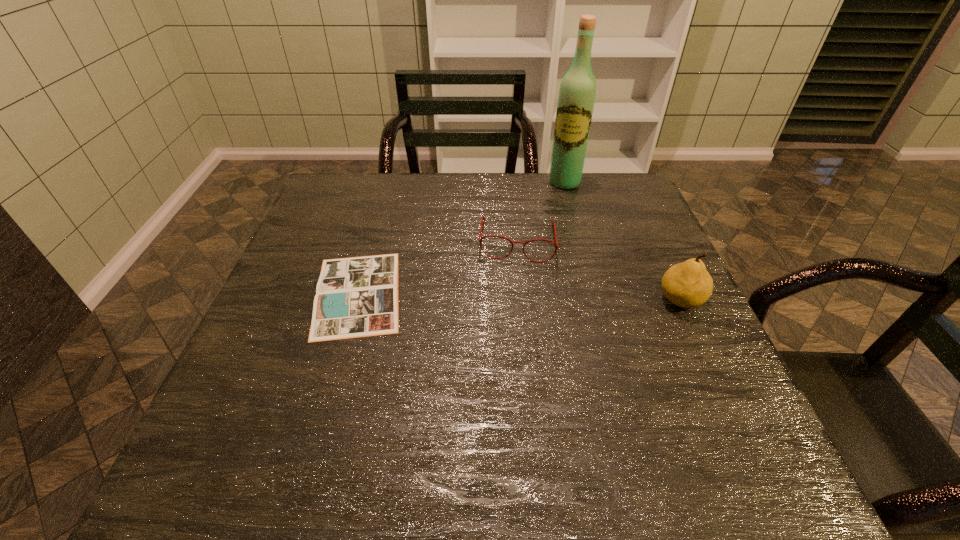
Find the location of a particular element. vacant spot on the desktop that is between the book and the third shortest object and is positioned on the front-facing side of the wine bottle is located at coordinates (532, 298).

You are a GUI agent. You are given a task and a screenshot of the screen. Output one action in this format:
    pyautogui.click(x=<x>, y=<y>)
    Task: Click on the vacant space on the desktop that is between the book and the second tallest object and is positioned on the face of the second shortest object
    The image size is (960, 540).
    Given the screenshot: What is the action you would take?
    pyautogui.click(x=513, y=297)